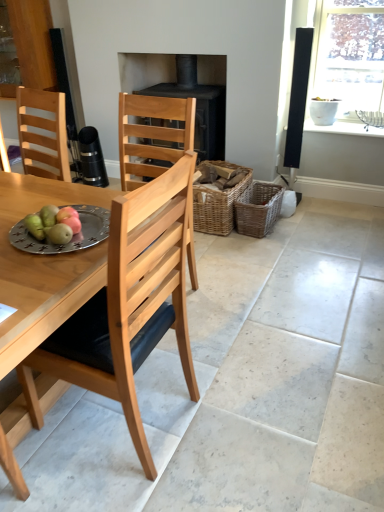
This screenshot has width=384, height=512. I want to click on free point below natural wood chair at center (from a real-world perspective), so click(143, 422).